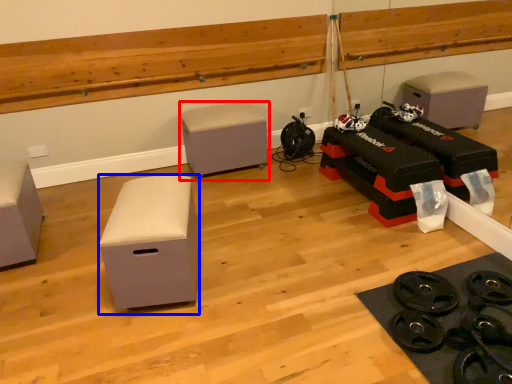
Question: Which object appears farthest to the camera in this image, furniture (highlighted by a red box) or furniture (highlighted by a blue box)?

Choices:
 (A) furniture
 (B) furniture

Answer: (A)